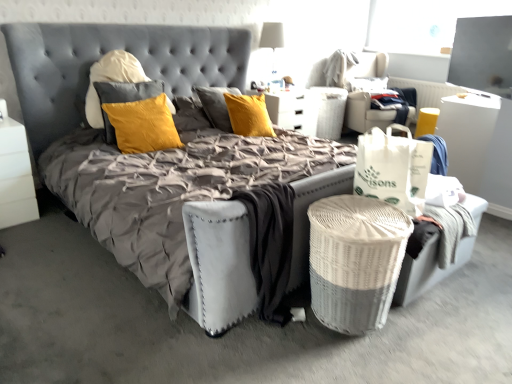
The height and width of the screenshot is (384, 512). Find the location of `unoccupied region to the right of white wicker laundry basket at lower right`. unoccupied region to the right of white wicker laundry basket at lower right is located at coordinates (436, 334).